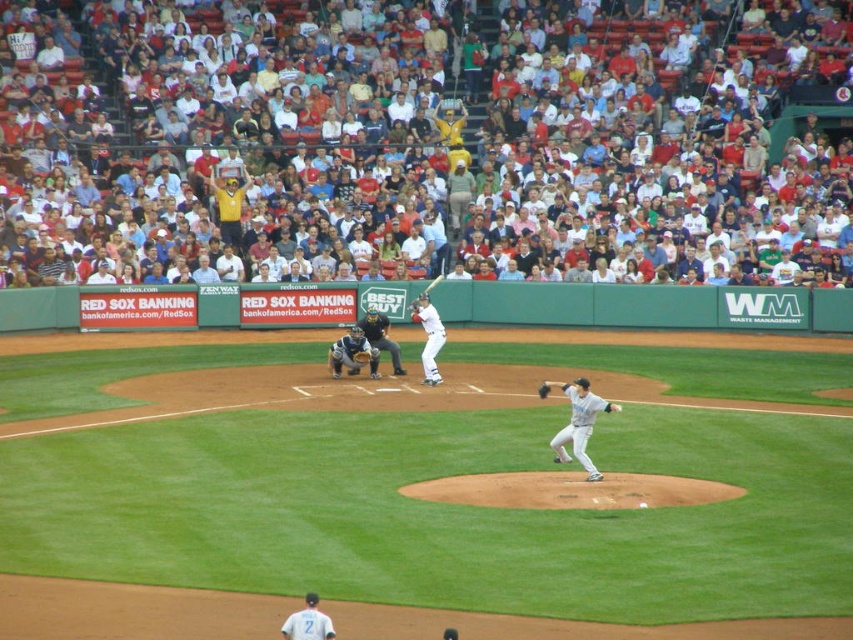
Who is higher up, yellow jersey at upper center or dark brown leather glove at center?

yellow jersey at upper center

Between yellow jersey at upper center and dark brown leather glove at center, which one appears on the right side from the viewer's perspective?

dark brown leather glove at center

Is point (231, 243) farther from camera compared to point (410, 307)?

Yes.

This screenshot has width=853, height=640. Find the location of `yellow jersey at upper center`. yellow jersey at upper center is located at coordinates (230, 204).

Is white uniform catcher at center taller than dark brown leather glove at center?

Correct, white uniform catcher at center is much taller as dark brown leather glove at center.

You are a GUI agent. You are given a task and a screenshot of the screen. Output one action in this format:
    pyautogui.click(x=<x>, y=<y>)
    Task: Click on the white uniform catcher at center
    The width and height of the screenshot is (853, 640).
    Given the screenshot: What is the action you would take?
    click(x=380, y=337)

Consider the image. Who is more forward, (x=370, y=342) or (x=415, y=312)?

Positioned in front is point (x=415, y=312).

Find the location of a particular element. The height and width of the screenshot is (640, 853). white uniform catcher at center is located at coordinates (380, 337).

Which is in front, point (309, 604) or point (418, 298)?

Point (309, 604)

Does white jersey at center have a larger size compared to dark brown leather glove at center?

Actually, white jersey at center might be smaller than dark brown leather glove at center.

Is point (306, 604) positioned behind point (421, 305)?

That is False.

Locate an element on the screen. white jersey at center is located at coordinates [308, 621].